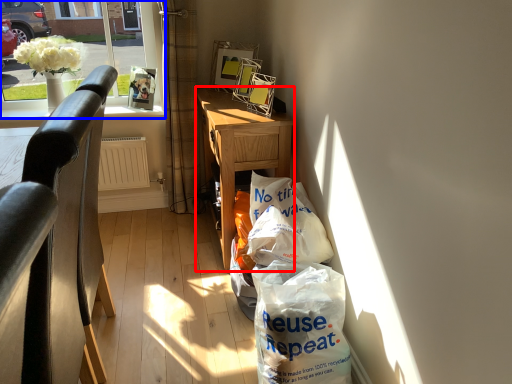
Question: Among these objects, which one is farthest to the camera, desk (highlighted by a red box) or window (highlighted by a blue box)?

Choices:
 (A) desk
 (B) window

Answer: (B)